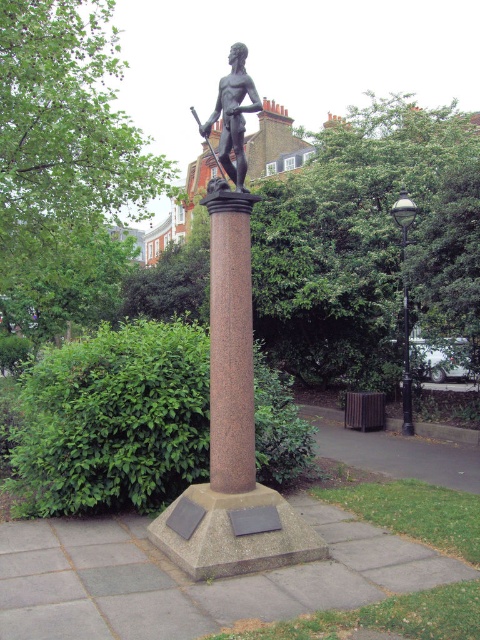
Based on the photo, you are standing at point 0.0, 0.0 in the park. You want to take a photo of the bronze statue at center. Which direction should you walk to get closer to it?

You should walk towards the northeast direction to reach the bronze statue at center located at point (232, 115).

You are standing at the statue and want to walk to the point marked as point (396, 221). However, there is an obstacle located at point (224, 102). Will you encounter the obstacle before reaching your destination?

Yes, you will encounter the obstacle at point (224, 102) before reaching point (396, 221) because point (224, 102) is in front of point (396, 221).

You are a city planner assessing the space around the statue. You need to place a new bench that must be smaller than the granite column at center. Can the bench be placed near the black polished metal lamp post at right without exceeding the size of the existing objects?

The granite column at center is bigger than the black polished metal lamp post at right. Since the bench must be smaller than the granite column, it can be placed near the black polished metal lamp post at right as long as it doesn